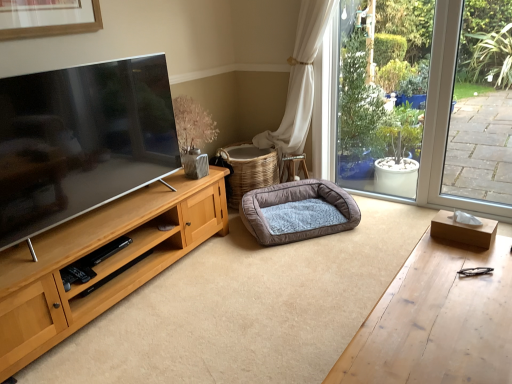
Question: Is woven brown basket at center bigger or smaller than brown plush dog bed at center?

Choices:
 (A) big
 (B) small

Answer: (A)

Question: Is woven brown basket at center to the left or to the right of brown plush dog bed at center in the image?

Choices:
 (A) right
 (B) left

Answer: (B)

Question: Which object is the closest to the wooden desk at lower right?

Choices:
 (A) brown plush dog bed at center
 (B) woven brown basket at center

Answer: (A)

Question: Estimate the real-world distances between objects in this image. Which object is farther from the brown plush dog bed at center?

Choices:
 (A) woven brown basket at center
 (B) wooden desk at lower right

Answer: (B)